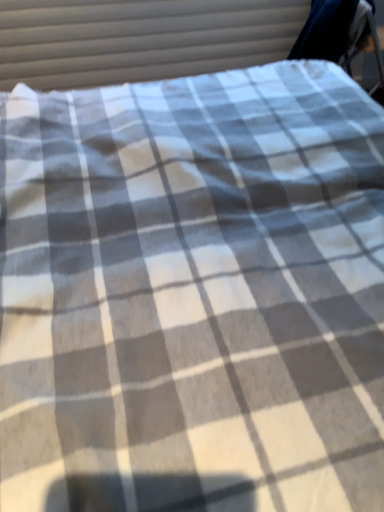
Question: Is dark blue fabric swivel chair at upper right to the left or to the right of white checkered fabric at upper center in the image?

Choices:
 (A) right
 (B) left

Answer: (A)

Question: Is dark blue fabric swivel chair at upper right situated inside white checkered fabric at upper center or outside?

Choices:
 (A) outside
 (B) inside

Answer: (A)

Question: Relative to white checkered fabric at upper center, is dark blue fabric swivel chair at upper right in front or behind?

Choices:
 (A) front
 (B) behind

Answer: (A)

Question: From a real-world perspective, is white checkered fabric at upper center physically located above or below dark blue fabric swivel chair at upper right?

Choices:
 (A) below
 (B) above

Answer: (A)

Question: From their relative heights in the image, would you say white checkered fabric at upper center is taller or shorter than dark blue fabric swivel chair at upper right?

Choices:
 (A) tall
 (B) short

Answer: (A)

Question: Considering the positions of white checkered fabric at upper center and dark blue fabric swivel chair at upper right in the image, is white checkered fabric at upper center wider or thinner than dark blue fabric swivel chair at upper right?

Choices:
 (A) wide
 (B) thin

Answer: (B)

Question: Is point (261, 55) closer or farther from the camera than point (322, 35)?

Choices:
 (A) farther
 (B) closer

Answer: (A)